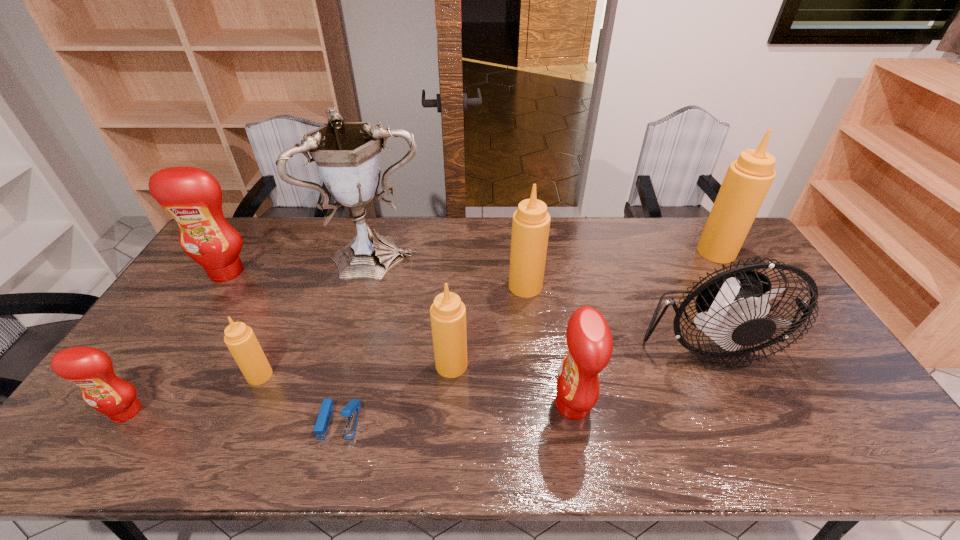
The width and height of the screenshot is (960, 540). Find the location of `condiment that is positioned at the right edge`. condiment that is positioned at the right edge is located at coordinates click(x=747, y=181).

Locate an element on the screen. Image resolution: width=960 pixels, height=540 pixels. fan located at the right edge is located at coordinates (732, 305).

Where is `object located in the far right corner section of the desktop`? The height and width of the screenshot is (540, 960). object located in the far right corner section of the desktop is located at coordinates (747, 181).

Find the location of a particular element. vacant space at the far edge is located at coordinates (643, 237).

Image resolution: width=960 pixels, height=540 pixels. Identify the location of free space at the left edge. (132, 422).

Locate an element on the screen. The width and height of the screenshot is (960, 540). blank area at the near right corner is located at coordinates (x=848, y=437).

Find the location of a particular element. This screenshot has width=960, height=540. free space between the biggest tan condiment and the smallest red condiment is located at coordinates (421, 332).

Locate an element on the screen. This screenshot has width=960, height=540. vacant point located between the third nearest tan condiment and the rightmost tan condiment is located at coordinates [621, 269].

At what (x,y) coordinates should I click in order to perform the action: click on vacant area that lies between the second farthest tan condiment and the second smallest red condiment. Please return your answer as a coordinate pair (x, y). Looking at the image, I should click on (549, 346).

At what (x,y) coordinates should I click in order to perform the action: click on empty space between the third nearest tan condiment and the rightmost red condiment. Please return your answer as a coordinate pair (x, y). This screenshot has height=540, width=960. Looking at the image, I should click on (549, 346).